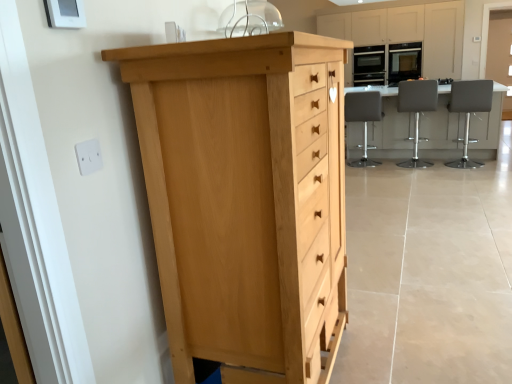
Question: Can you confirm if leatherette stool at center, marked as the 2th chair in a left-to-right arrangement, is taller than transparent glass door at upper right?

Choices:
 (A) yes
 (B) no

Answer: (B)

Question: Is leatherette stool at center, marked as the 2th chair in a left-to-right arrangement, surrounding transparent glass door at upper right?

Choices:
 (A) yes
 (B) no

Answer: (B)

Question: Does leatherette stool at center, marked as the 2th chair in a left-to-right arrangement, lie behind transparent glass door at upper right?

Choices:
 (A) no
 (B) yes

Answer: (A)

Question: Is leatherette stool at center, marked as the 2th chair in a left-to-right arrangement, positioned far away from transparent glass door at upper right?

Choices:
 (A) no
 (B) yes

Answer: (B)

Question: Is leatherette stool at center, the 2th chair positioned from the right, not inside transparent glass door at upper right?

Choices:
 (A) no
 (B) yes

Answer: (B)

Question: From the image's perspective, is leatherette stool at center, marked as the 2th chair in a left-to-right arrangement, on top of transparent glass door at upper right?

Choices:
 (A) no
 (B) yes

Answer: (A)

Question: Is matte black oven at upper right, marked as the second appliance in a right-to-left arrangement, outside of white plastic electric outlet at upper left?

Choices:
 (A) no
 (B) yes

Answer: (B)

Question: Is matte black oven at upper right, marked as the second appliance in a right-to-left arrangement, facing away from white plastic electric outlet at upper left?

Choices:
 (A) no
 (B) yes

Answer: (A)

Question: Is matte black oven at upper right, placed as the 1th appliance when sorted from left to right, far away from white plastic electric outlet at upper left?

Choices:
 (A) yes
 (B) no

Answer: (A)

Question: From the image's perspective, does matte black oven at upper right, placed as the 1th appliance when sorted from left to right, appear lower than white plastic electric outlet at upper left?

Choices:
 (A) yes
 (B) no

Answer: (B)

Question: Considering the relative sizes of matte black oven at upper right, placed as the 1th appliance when sorted from left to right, and white plastic electric outlet at upper left in the image provided, is matte black oven at upper right, placed as the 1th appliance when sorted from left to right, taller than white plastic electric outlet at upper left?

Choices:
 (A) yes
 (B) no

Answer: (A)

Question: Can you confirm if matte black oven at upper right, placed as the 1th appliance when sorted from left to right, is shorter than white plastic electric outlet at upper left?

Choices:
 (A) yes
 (B) no

Answer: (B)

Question: From the image's perspective, is white plastic electric outlet at upper left below leatherette stool at center, the 2th chair positioned from the right?

Choices:
 (A) yes
 (B) no

Answer: (A)